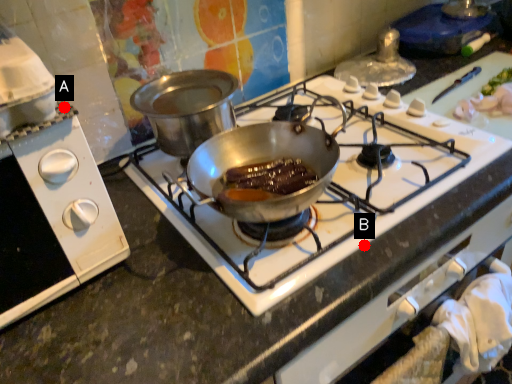
Question: Two points are circled on the image, labeled by A and B beside each circle. Among these points, which one is farthest from the camera?

Choices:
 (A) A is further
 (B) B is further

Answer: (B)